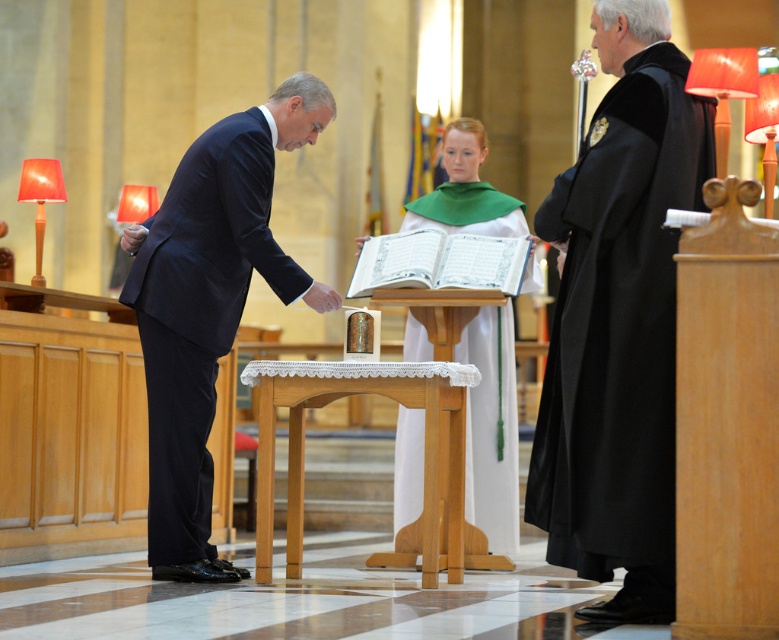
Is dark blue suit at left taller than wooden altar at center?

Correct, dark blue suit at left is much taller as wooden altar at center.

Which is behind, point (214, 310) or point (425, 428)?

The point (425, 428) is behind.

You are a GUI agent. You are given a task and a screenshot of the screen. Output one action in this format:
    pyautogui.click(x=<x>, y=<y>)
    Task: Click on the dark blue suit at left
    This screenshot has width=779, height=640.
    Given the screenshot: What is the action you would take?
    pyautogui.click(x=210, y=305)

Can you confirm if wooden altar at center is positioned to the left of white cloth at center?

Correct, you'll find wooden altar at center to the left of white cloth at center.

Does wooden altar at center appear on the right side of white cloth at center?

Incorrect, wooden altar at center is not on the right side of white cloth at center.

What do you see at coordinates (423, 465) in the screenshot?
I see `wooden altar at center` at bounding box center [423, 465].

Where is `wooden altar at center`? wooden altar at center is located at coordinates (423, 465).

Does point (587, 564) lie behind point (478, 496)?

No, it is not.

What do you see at coordinates (619, 328) in the screenshot?
I see `black velvet robe at right` at bounding box center [619, 328].

Where is `black velvet robe at right`? The width and height of the screenshot is (779, 640). black velvet robe at right is located at coordinates (619, 328).